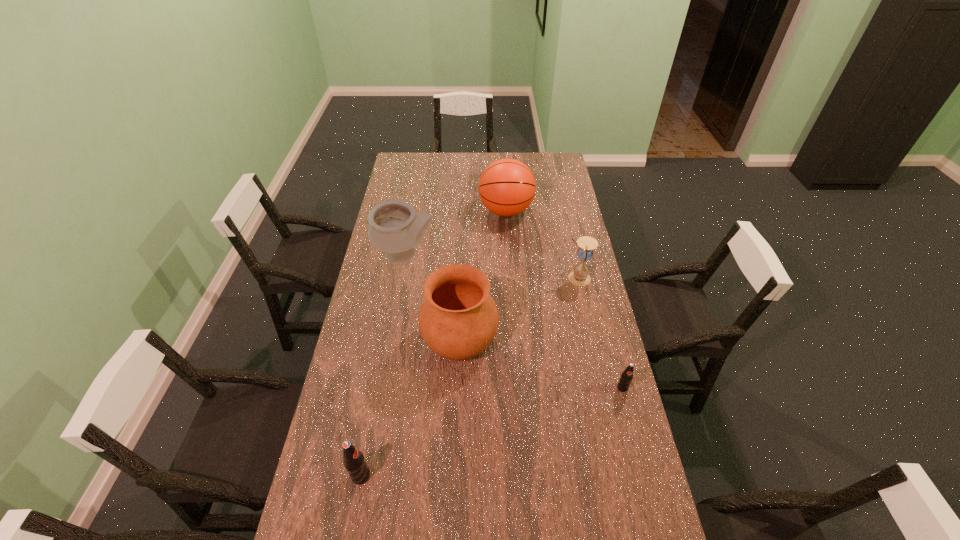
The width and height of the screenshot is (960, 540). I want to click on the left pop, so click(353, 459).

Identify the location of the nearer pop. This screenshot has width=960, height=540. (353, 459).

Find the location of `the fifth farthest object`. the fifth farthest object is located at coordinates (626, 378).

At what (x,y) coordinates should I click in order to perform the action: click on the shorter pop. Please return your answer as a coordinate pair (x, y). This screenshot has height=540, width=960. Looking at the image, I should click on (626, 378).

Find the location of `the nearer pottery`. the nearer pottery is located at coordinates (x=458, y=319).

This screenshot has width=960, height=540. In order to click on basketball in this screenshot , I will do `click(507, 187)`.

This screenshot has height=540, width=960. In order to click on the farther pottery in this screenshot , I will do `click(394, 228)`.

Identify the location of hourglass. This screenshot has height=540, width=960. (579, 276).

Identify the location of vacant space situated 0.350m on the front label of the nearest object. (494, 476).

You are a GUI agent. You are given a task and a screenshot of the screen. Output one action in this format:
    pyautogui.click(x=<x>, y=<y>)
    Task: Click on the vacant space located on the front label of the right pop
    Image resolution: width=960 pixels, height=540 pixels.
    Given the screenshot: What is the action you would take?
    pyautogui.click(x=657, y=521)